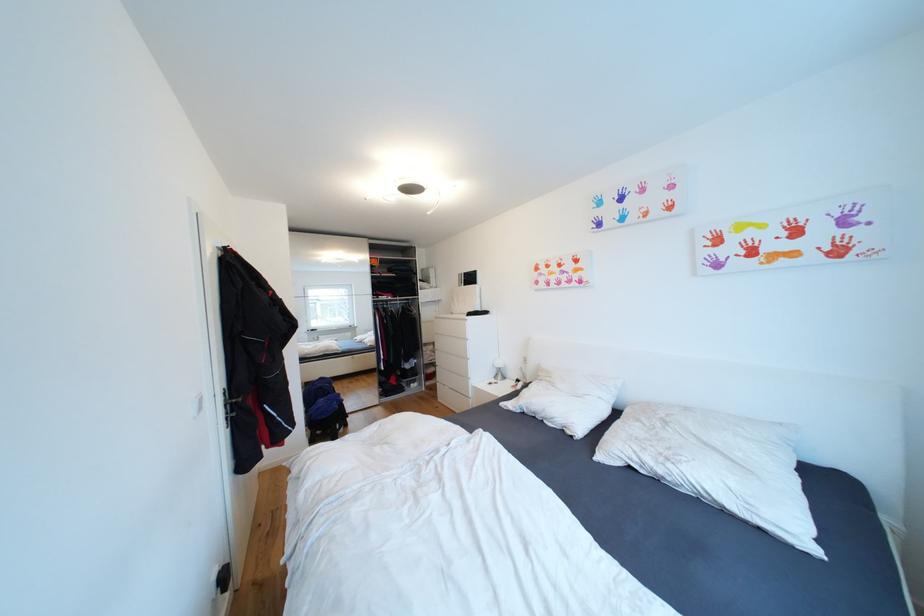
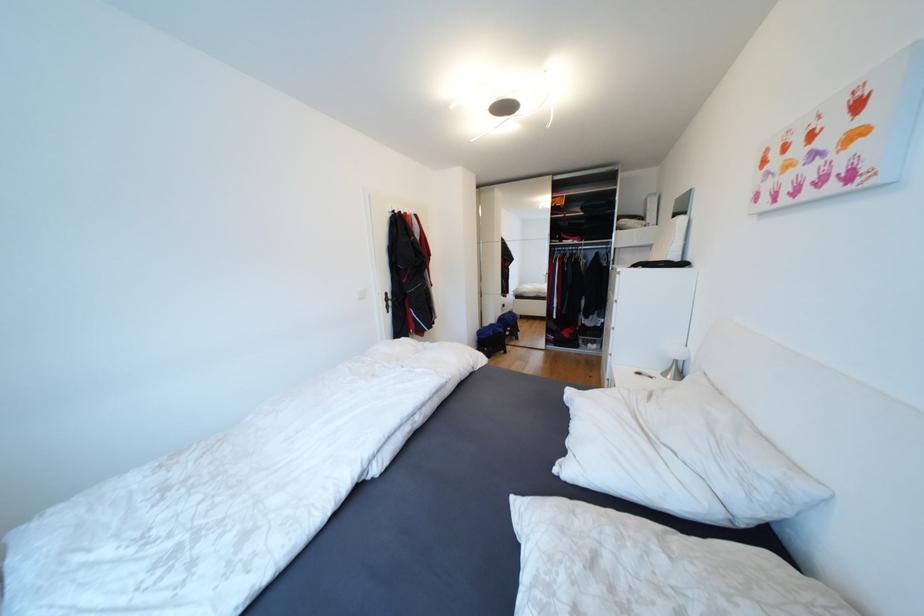
Find the pixel in the second image that matches point 506,365 in the first image.

(682, 354)